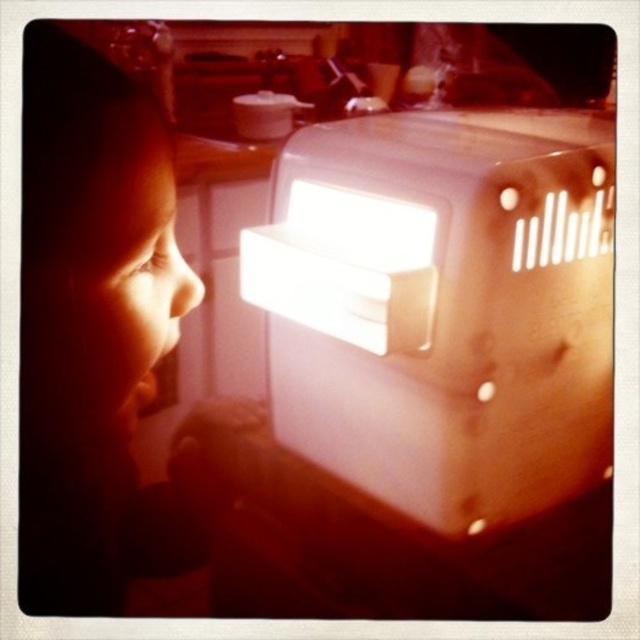
You are a parent in a kitchen with a white plastic oven at center and a matte skin child at left. The oven is hot. Should you be concerned about the child getting burned?

The distance between the white plastic oven at center and the matte skin child at left is 27.20 centimeters. Since the oven is hot, this close proximity could pose a burn risk to the matte skin child at left, so you should be concerned.